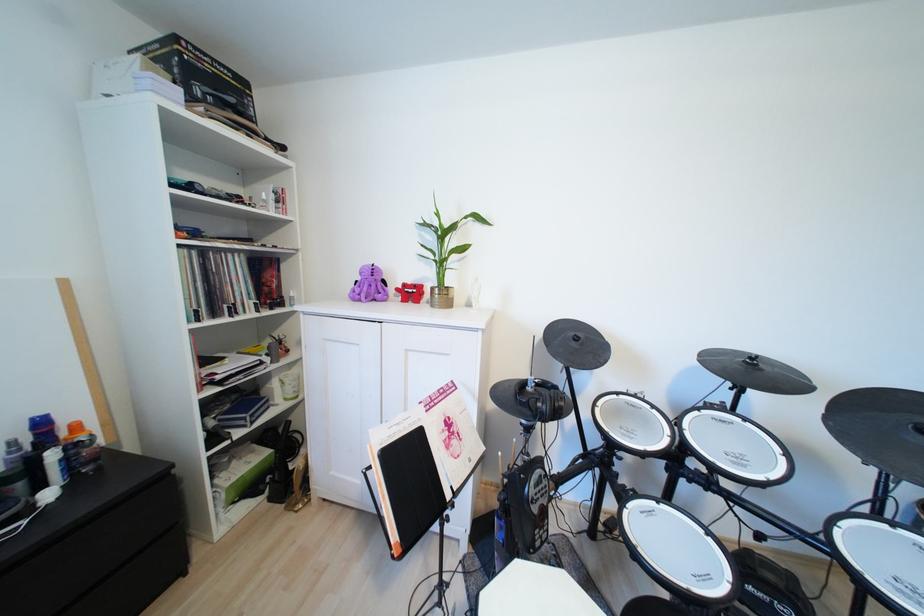
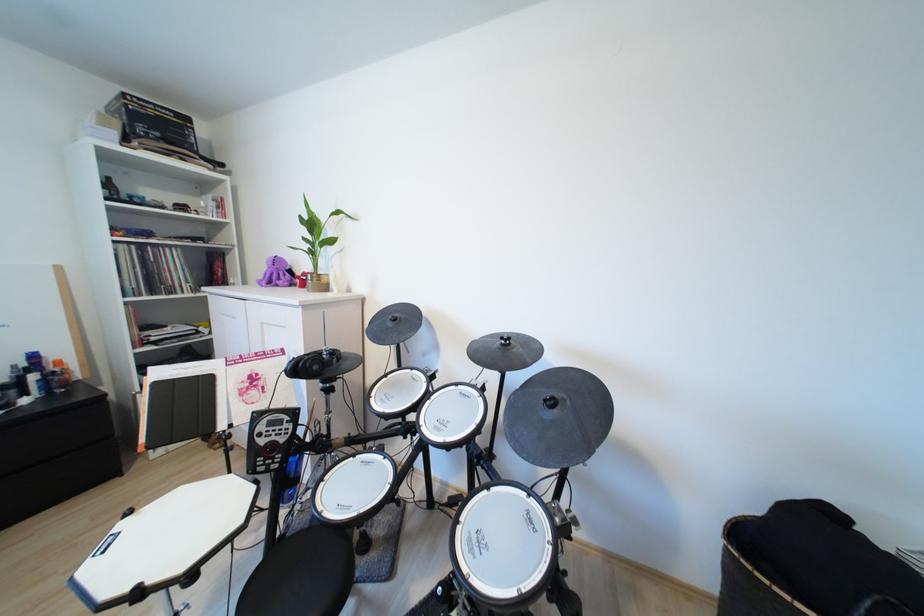
Find the pixel in the second image that matches the point at 83,428 in the first image.

(66, 363)